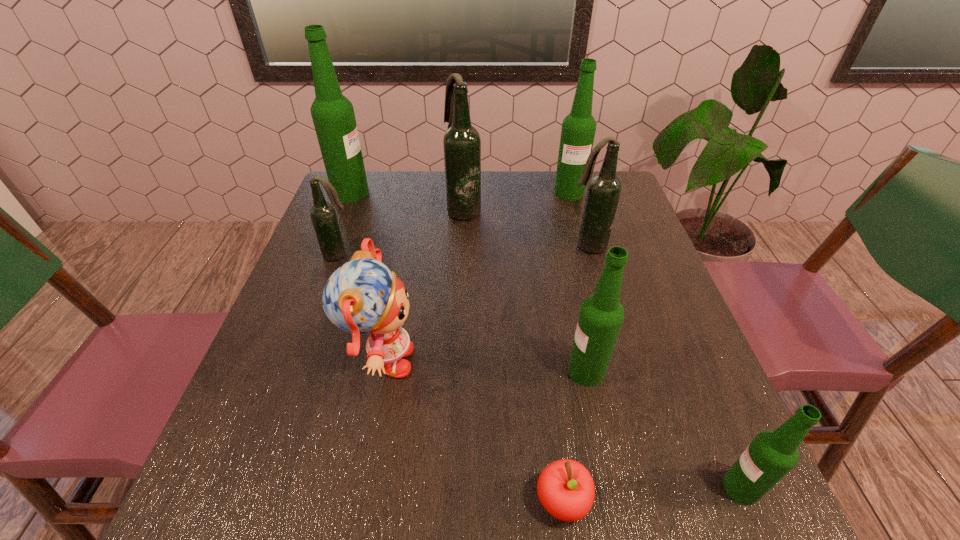
In order to click on object present at the far right corner in this screenshot , I will do `click(578, 130)`.

Where is `object positioned at the near right corner`? object positioned at the near right corner is located at coordinates (771, 455).

You are a GUI agent. You are given a task and a screenshot of the screen. Output one action in this format:
    pyautogui.click(x=<x>, y=<y>)
    Task: Click on the vacant area at the far edge of the desktop
    The height and width of the screenshot is (540, 960).
    Given the screenshot: What is the action you would take?
    pyautogui.click(x=511, y=184)

What are the coordinates of `vacant region at the near edge of the desktop` in the screenshot? It's located at (587, 515).

In the image, there is a desktop. What are the coordinates of `blank space at the left edge` in the screenshot? It's located at (266, 387).

The height and width of the screenshot is (540, 960). What are the coordinates of `vacant space at the right edge` in the screenshot? It's located at (623, 229).

The height and width of the screenshot is (540, 960). In order to click on vacant space at the far left corner of the desktop in this screenshot , I will do `click(370, 205)`.

This screenshot has height=540, width=960. In the image, there is a desktop. Identify the location of vacant space at the near right corner. (652, 474).

Where is `unoccupied position between the leftmost dark beer bottle and the second biggest green beer bottle`? The image size is (960, 540). unoccupied position between the leftmost dark beer bottle and the second biggest green beer bottle is located at coordinates (454, 224).

You are a GUI agent. You are given a task and a screenshot of the screen. Output one action in this format:
    pyautogui.click(x=<x>, y=<y>)
    Task: Click on the vacant area between the leftmost green beer bottle and the red apple
    
    Given the screenshot: What is the action you would take?
    457,347